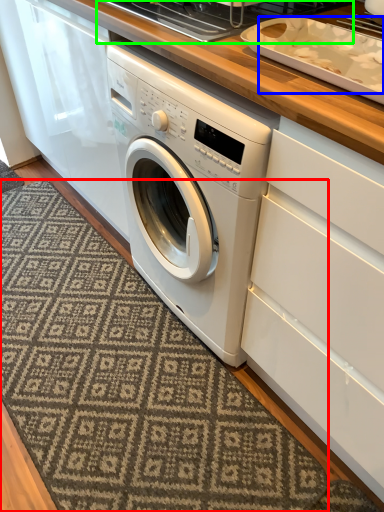
Question: Which object is the farthest from doormat (highlighted by a red box)? Choose among these: food (highlighted by a blue box) or appliance (highlighted by a green box).

Choices:
 (A) food
 (B) appliance

Answer: (B)